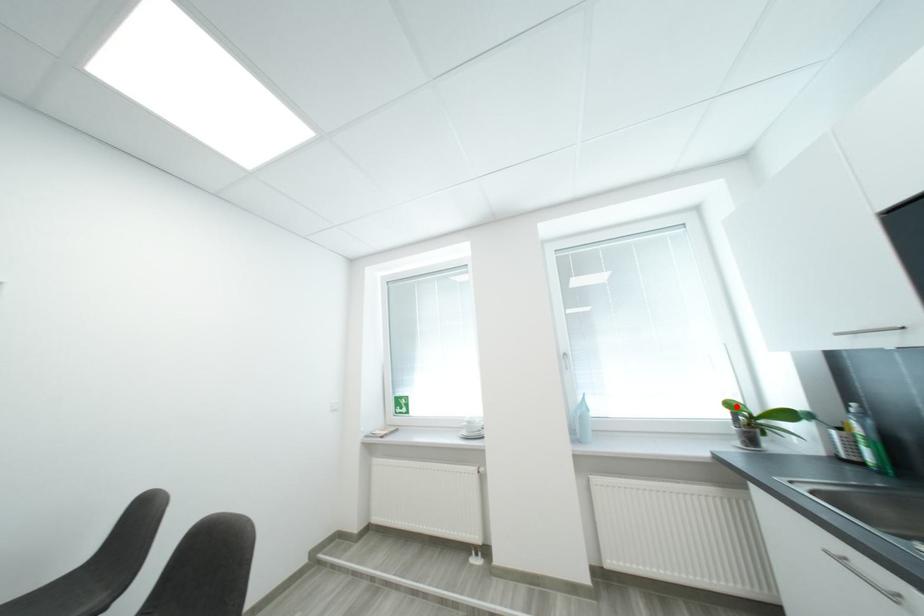
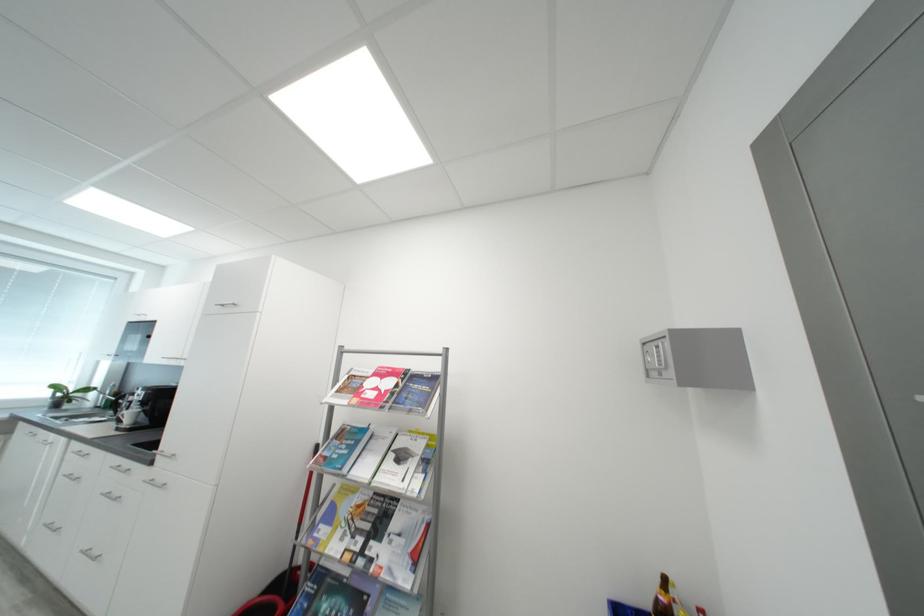
Where in the second image is the point corresponding to the highlighted location from the first image?

(62, 389)